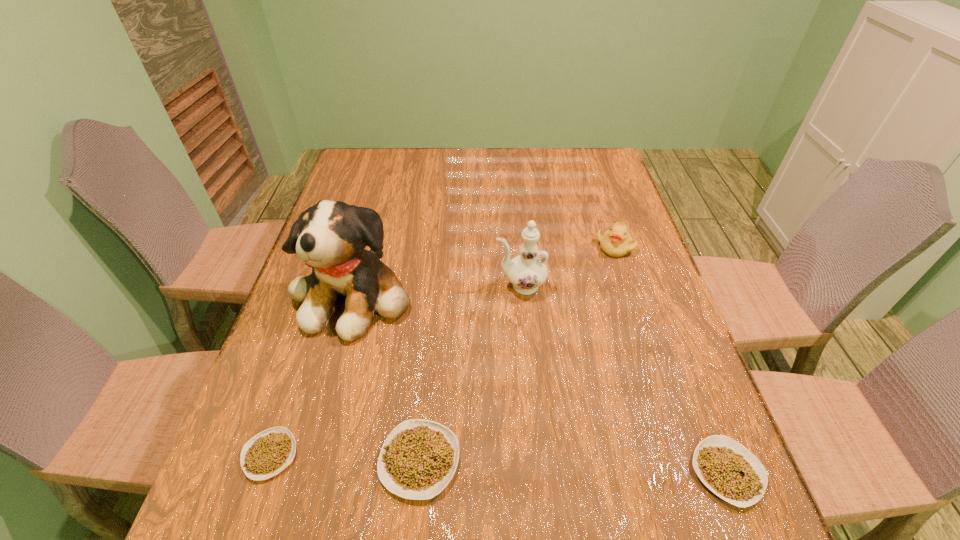
Image resolution: width=960 pixels, height=540 pixels. I want to click on the leftmost legume, so click(269, 452).

This screenshot has width=960, height=540. What are the coordinates of `the shortest object` in the screenshot? It's located at (269, 452).

The width and height of the screenshot is (960, 540). In order to click on the tallest legume in this screenshot , I will do `click(418, 459)`.

The image size is (960, 540). Find the location of `the fourth tallest object`. the fourth tallest object is located at coordinates (418, 459).

The height and width of the screenshot is (540, 960). Identify the location of the second shortest legume. (727, 468).

The width and height of the screenshot is (960, 540). What are the coordinates of `the rightmost legume` in the screenshot? It's located at (727, 468).

Where is `the third tallest object`? Image resolution: width=960 pixels, height=540 pixels. the third tallest object is located at coordinates (616, 242).

I want to click on puppy, so click(x=331, y=236).

Where is `chinaware`? chinaware is located at coordinates (526, 272).

I want to click on the third object from right to left, so [x=526, y=272].